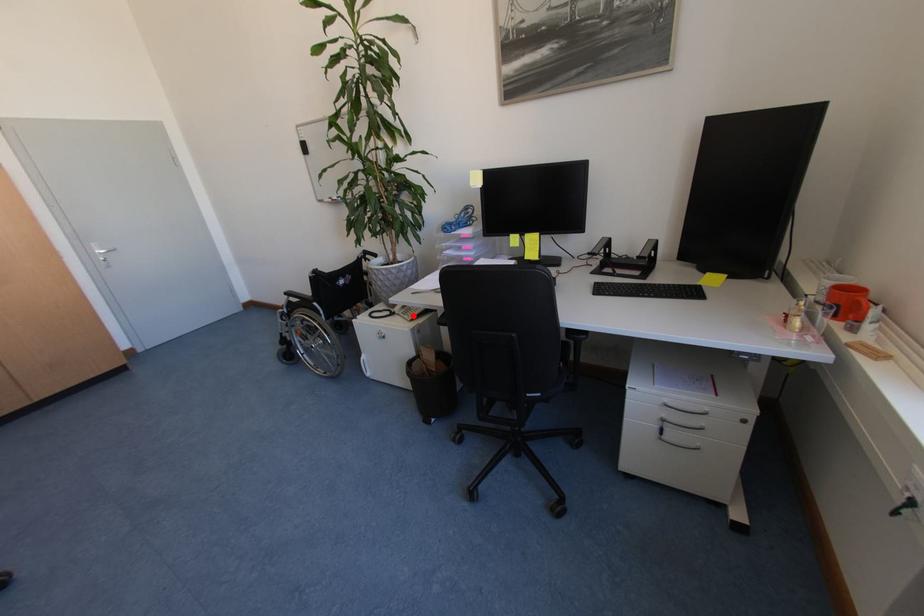
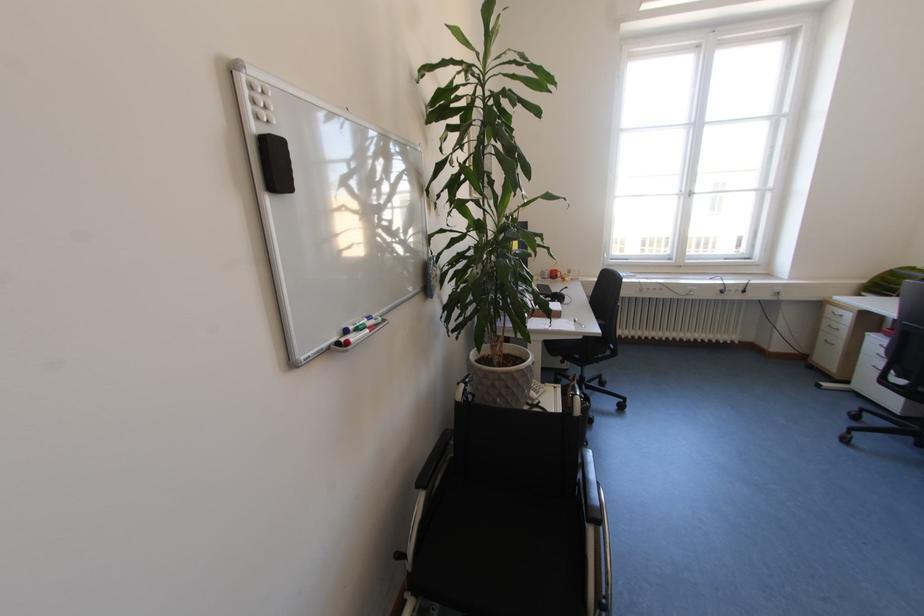
Find the pixel in the second image that matches the highlighted location in the first image.

(546, 392)